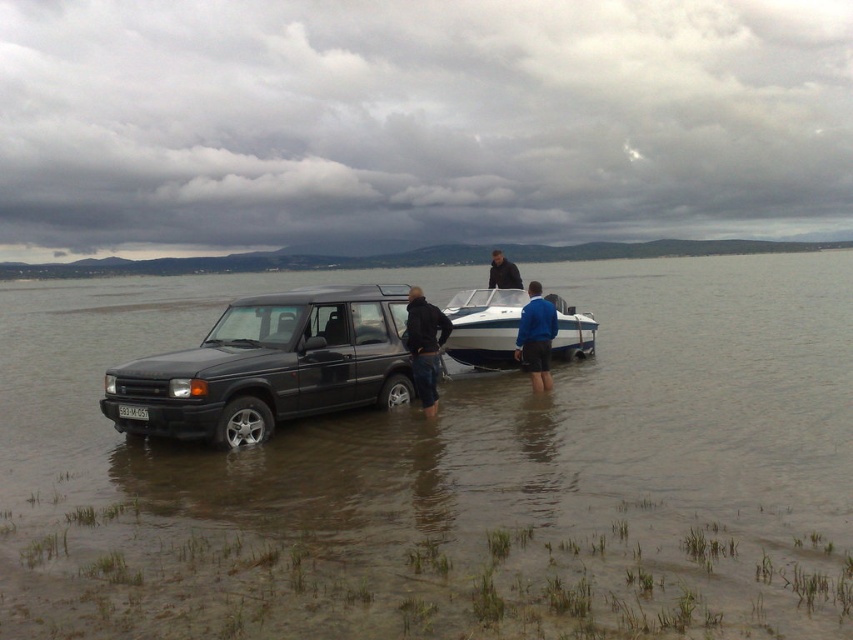
Question: Can you confirm if matte black suv at center is positioned to the right of white plastic license plate at center?

Choices:
 (A) no
 (B) yes

Answer: (B)

Question: Which of the following is the farthest from the observer?

Choices:
 (A) (526, 300)
 (B) (518, 288)

Answer: (B)

Question: Is dark brown leather jacket at center closer to camera compared to white plastic license plate at center?

Choices:
 (A) no
 (B) yes

Answer: (A)

Question: Which of the following is the closest to the observer?

Choices:
 (A) dark blue jeans at center
 (B) blue fabric jacket at center
 (C) white glossy boat at center
 (D) clear water at center

Answer: (D)

Question: Which of these objects is positioned closest to the white glossy boat at center?

Choices:
 (A) matte black suv at center
 (B) clear water at center

Answer: (A)

Question: Considering the relative positions of clear water at center and matte black suv at center in the image provided, where is clear water at center located with respect to matte black suv at center?

Choices:
 (A) above
 (B) below

Answer: (A)